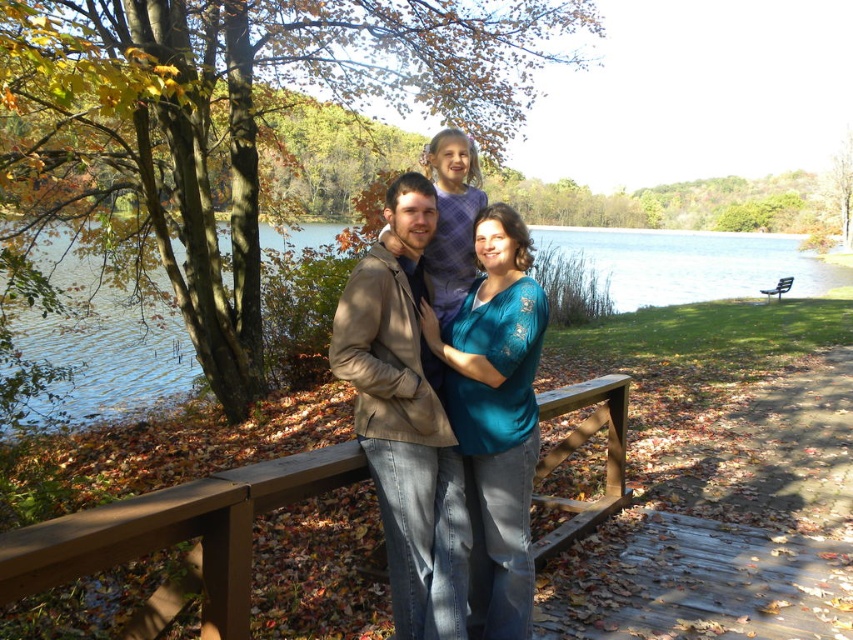
Question: Which is farther from the tan leather jacket at center?

Choices:
 (A) clear blue water at upper center
 (B) teal lace top at center
 (C) metallic silver bench at lower right

Answer: (C)

Question: Can you confirm if clear blue water at upper center is positioned to the left of teal lace top at center?

Choices:
 (A) yes
 (B) no

Answer: (B)

Question: Estimate the real-world distances between objects in this image. Which object is closer to the teal lace top at center?

Choices:
 (A) metallic silver bench at lower right
 (B) brown wooden rail at center
 (C) tan leather jacket at center
 (D) clear blue water at upper center

Answer: (C)

Question: Is brown wooden rail at center in front of metallic silver bench at lower right?

Choices:
 (A) no
 (B) yes

Answer: (B)

Question: Does clear blue water at upper center appear under metallic silver bench at lower right?

Choices:
 (A) yes
 (B) no

Answer: (B)

Question: Which of the following is the farthest from the observer?

Choices:
 (A) (627, 392)
 (B) (379, 461)

Answer: (A)